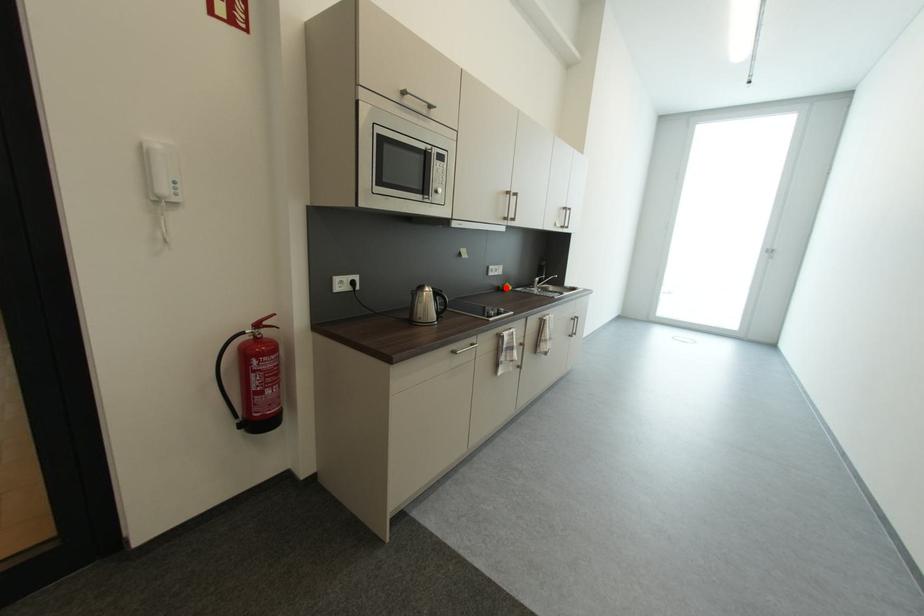
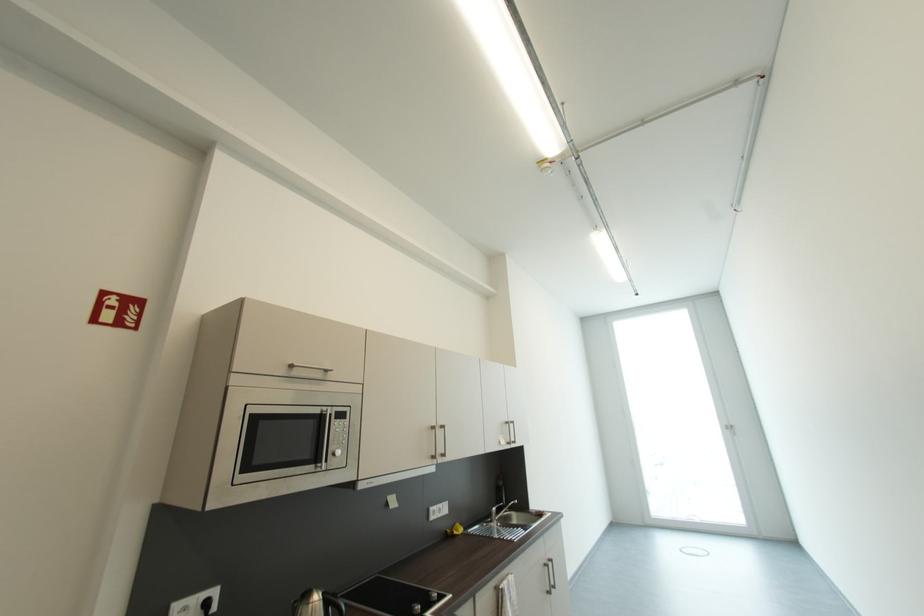
The point at the highlighted location is marked in the first image. Where is the corresponding point in the second image?

(454, 533)